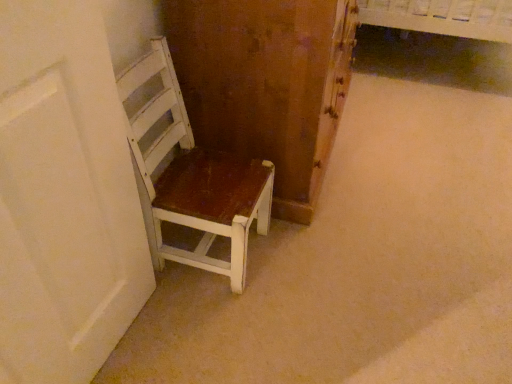
In order to click on free location to the right of white painted wood chair at left in this screenshot , I will do `click(297, 263)`.